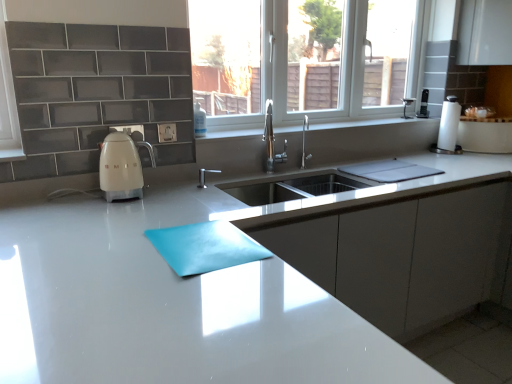
Where is `vacant area on top of teal glossy placemat at center (from a real-world perspective)`? vacant area on top of teal glossy placemat at center (from a real-world perspective) is located at coordinates (203, 236).